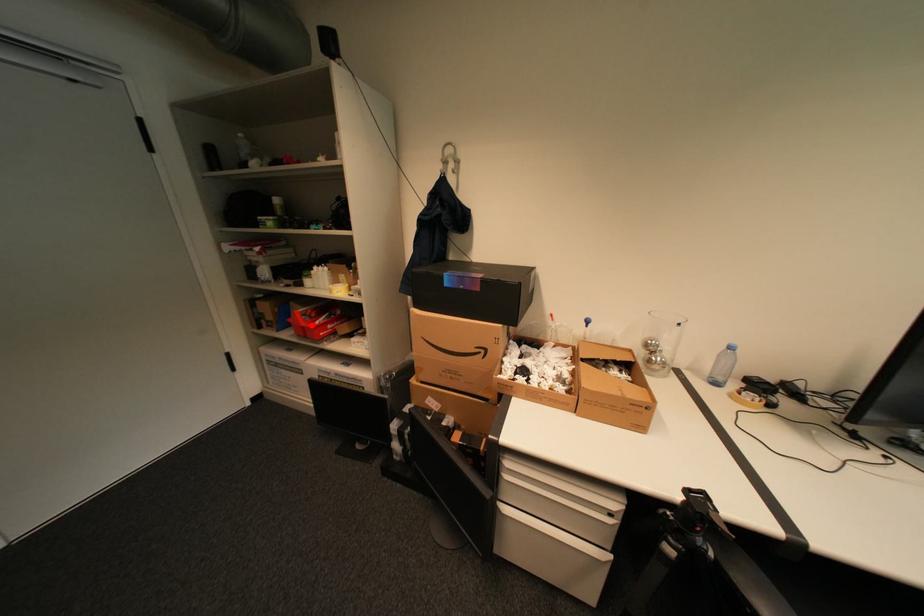
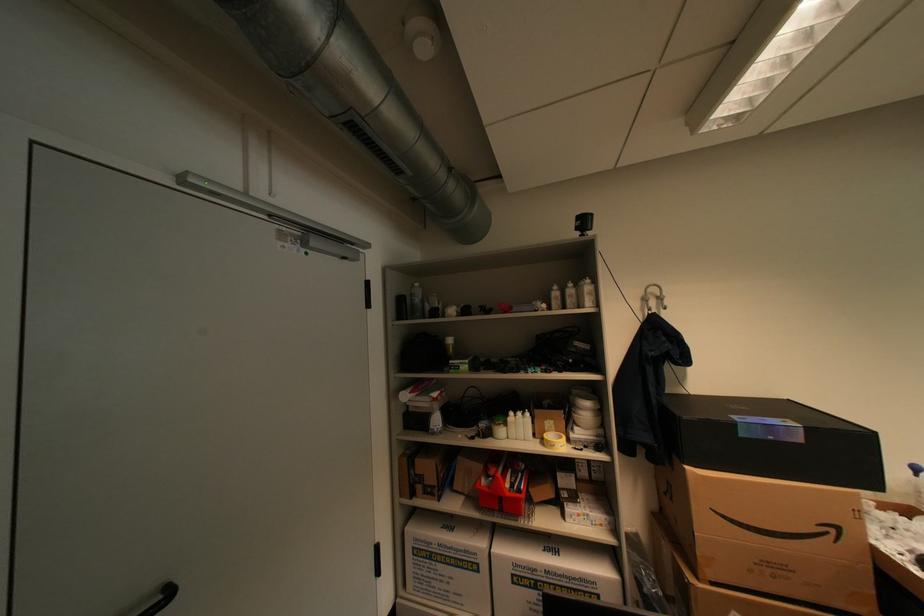
Where in the second image is the point corresponding to the highlighted location from the first image?

(516, 495)